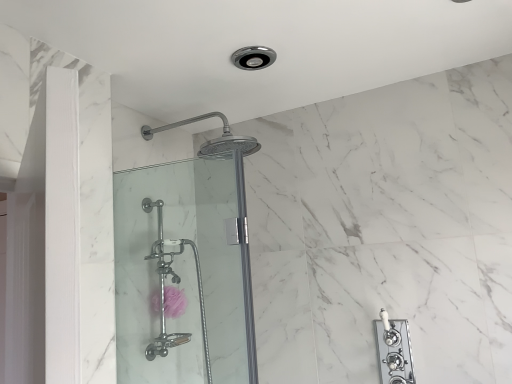
The image size is (512, 384). I want to click on pink sponge at lower center, so click(174, 302).

Describe the element at coordinates (174, 302) in the screenshot. This screenshot has width=512, height=384. I see `pink sponge at lower center` at that location.

Describe the element at coordinates (181, 275) in the screenshot. I see `clear glass shower door at center` at that location.

Find the location of a particular element. The width and height of the screenshot is (512, 384). clear glass shower door at center is located at coordinates (181, 275).

Where is `pink sponge at lower center`? The image size is (512, 384). pink sponge at lower center is located at coordinates (174, 302).

Visually, is clear glass shower door at center positioned to the left or to the right of pink sponge at lower center?

clear glass shower door at center is to the right of pink sponge at lower center.

Relative to pink sponge at lower center, is clear glass shower door at center in front or behind?

clear glass shower door at center is positioned closer to the viewer than pink sponge at lower center.

Is point (167, 378) in front of point (173, 296)?

No, it is behind (173, 296).

From the image's perspective, is clear glass shower door at center on pink sponge at lower center?

Correct, clear glass shower door at center appears higher than pink sponge at lower center in the image.

From a real-world perspective, is clear glass shower door at center located higher than pink sponge at lower center?

Yes.

Does clear glass shower door at center have a lesser width compared to pink sponge at lower center?

Correct, the width of clear glass shower door at center is less than that of pink sponge at lower center.

In the scene shown: Is clear glass shower door at center shorter than pink sponge at lower center?

No, clear glass shower door at center is not shorter than pink sponge at lower center.

Between clear glass shower door at center and pink sponge at lower center, which one has smaller size?

Smaller between the two is pink sponge at lower center.

Choose the correct answer: Is clear glass shower door at center inside pink sponge at lower center or outside it?

clear glass shower door at center is not inside pink sponge at lower center, it's outside.

Is clear glass shower door at center far from pink sponge at lower center?

They are positioned close to each other.

Is clear glass shower door at center aimed at pink sponge at lower center?

No, clear glass shower door at center is not facing towards pink sponge at lower center.

Find the location of a particular element. shower door above the pink sponge at lower center (from a real-world perspective) is located at coordinates (181, 275).

Is pink sponge at lower center at the left side of clear glass shower door at center?

Yes.

Relative to clear glass shower door at center, is pink sponge at lower center in front or behind?

In the image, pink sponge at lower center appears behind clear glass shower door at center.

Does point (168, 314) come farther from viewer compared to point (178, 332)?

That is False.

From the image's perspective, which object appears higher, pink sponge at lower center or clear glass shower door at center?

From the image's view, clear glass shower door at center is above.

From a real-world perspective, is pink sponge at lower center on clear glass shower door at center?

No, from a real-world perspective, pink sponge at lower center is not over clear glass shower door at center

Which object is thinner, pink sponge at lower center or clear glass shower door at center?

clear glass shower door at center is thinner.

Between pink sponge at lower center and clear glass shower door at center, which one has more height?

With more height is clear glass shower door at center.

Considering the sizes of objects pink sponge at lower center and clear glass shower door at center in the image provided, who is bigger, pink sponge at lower center or clear glass shower door at center?

clear glass shower door at center.

Is clear glass shower door at center surrounded by pink sponge at lower center?

No, pink sponge at lower center does not contain clear glass shower door at center.

Is pink sponge at lower center far away from clear glass shower door at center?

No, there isn't a large distance between pink sponge at lower center and clear glass shower door at center.

Is clear glass shower door at center at the back of pink sponge at lower center?

No.

How many degrees apart are the facing directions of pink sponge at lower center and clear glass shower door at center?

The angle between the facing direction of pink sponge at lower center and the facing direction of clear glass shower door at center is 89.9 degrees.

This screenshot has width=512, height=384. In order to click on flower behind the clear glass shower door at center in this screenshot , I will do `click(174, 302)`.

Locate an element on the screen. This screenshot has height=384, width=512. flower that appears below the clear glass shower door at center (from a real-world perspective) is located at coordinates (174, 302).

Locate an element on the screen. The width and height of the screenshot is (512, 384). shower door lying on the right of pink sponge at lower center is located at coordinates (181, 275).